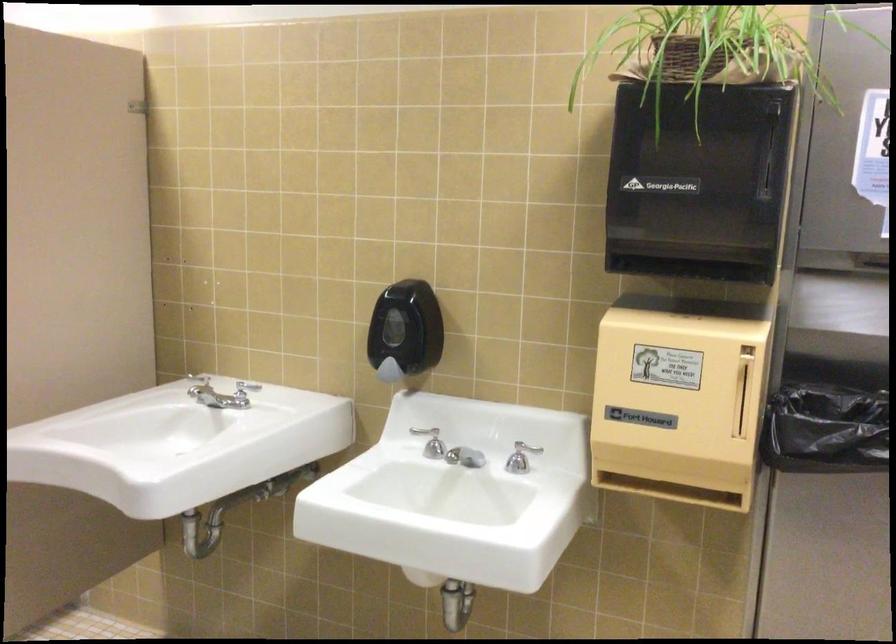
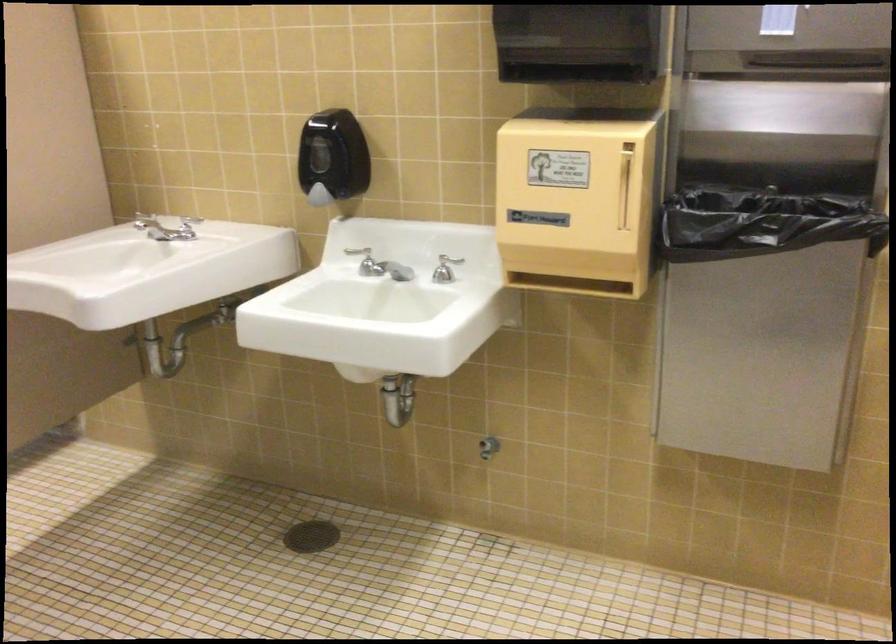
Question: The images are taken continuously from a first-person perspective. In which direction is your viewpoint rotating?

Choices:
 (A) Left
 (B) Right
 (C) Up
 (D) Down

Answer: (D)